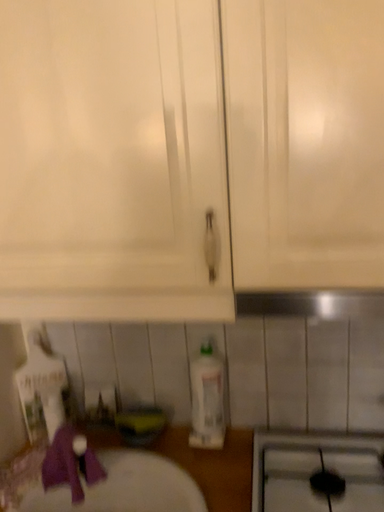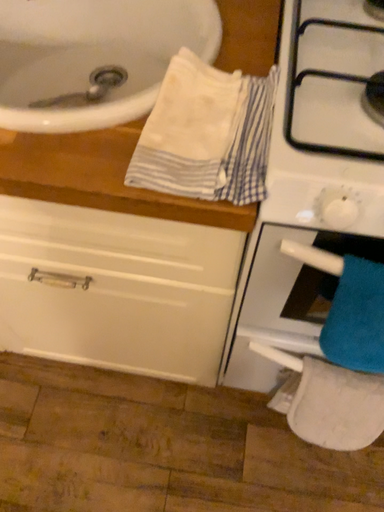
Question: Which way did the camera rotate in the video?

Choices:
 (A) rotated upward
 (B) rotated downward

Answer: (B)